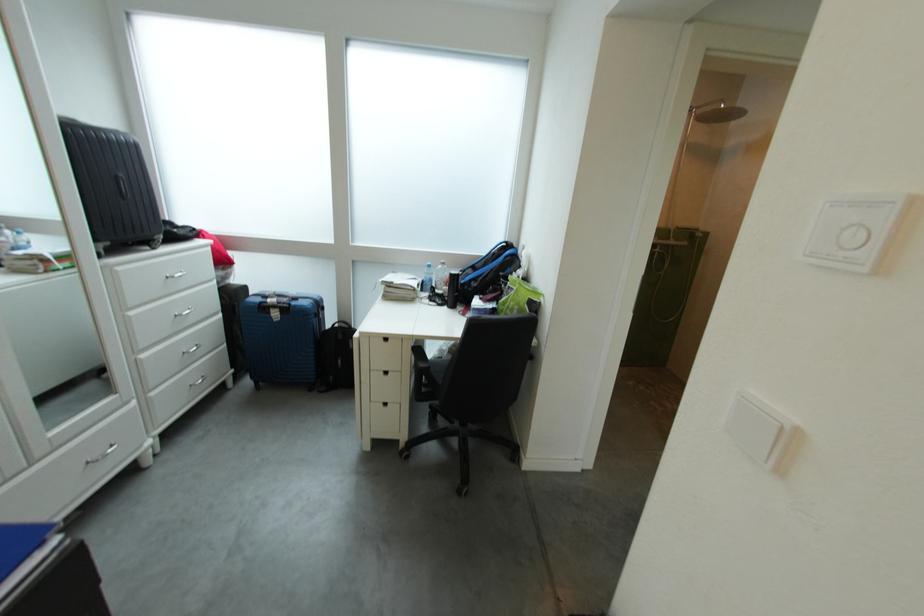
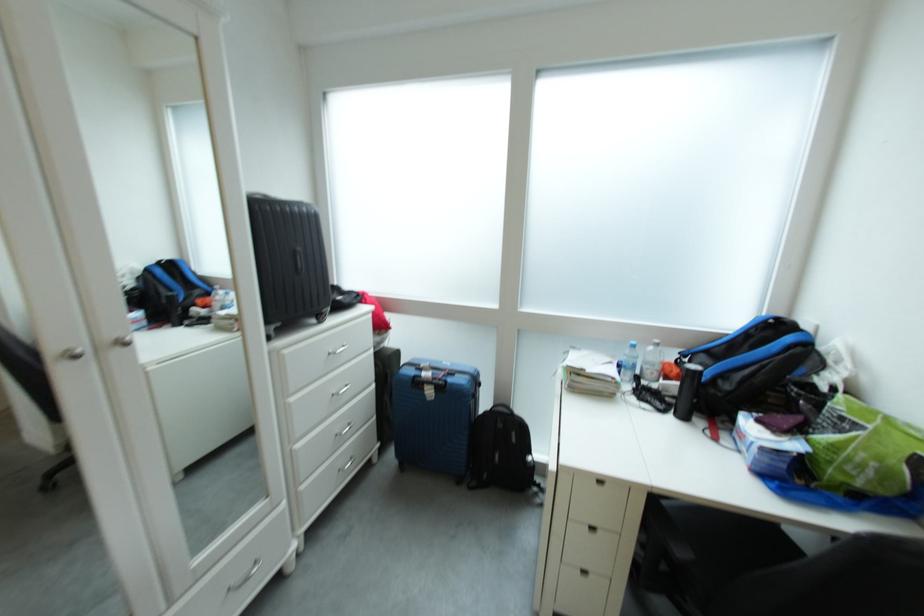
Find the pixel in the second image that matches the point at 176,281 in the first image.

(338, 355)